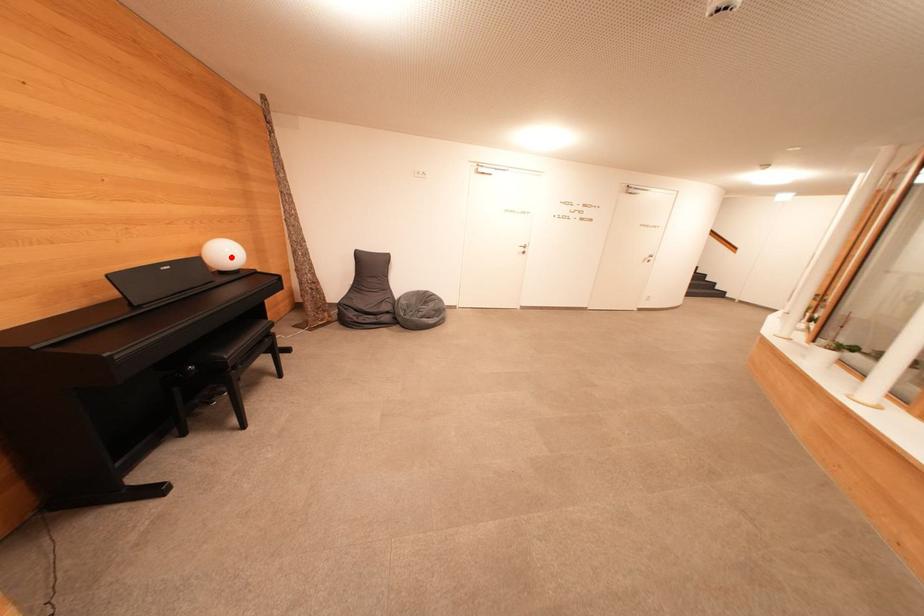
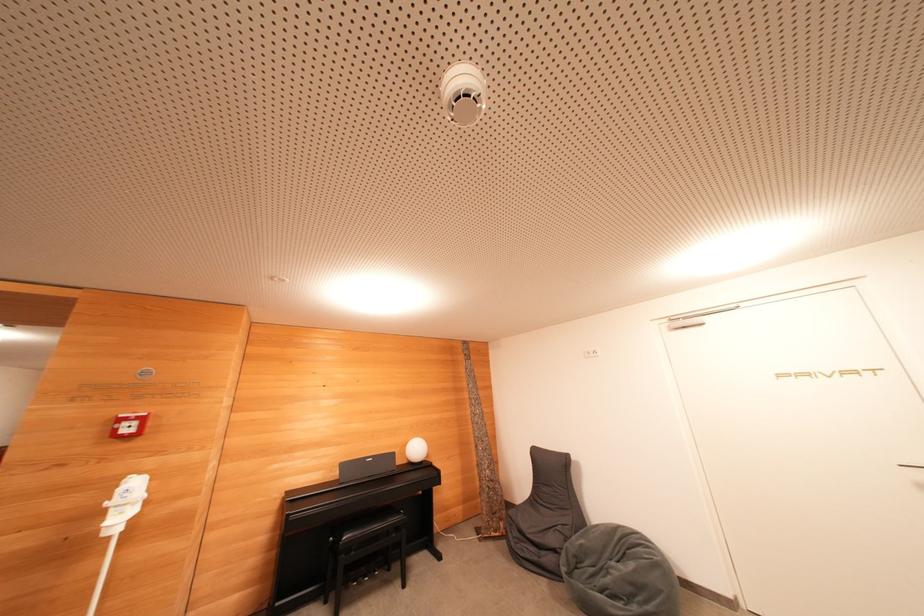
Question: I am providing you with two images of the same scene from different viewpoints. A red point is marked on the first image. Can you still see the location of the red point in image 2?

Choices:
 (A) Yes
 (B) No

Answer: (A)